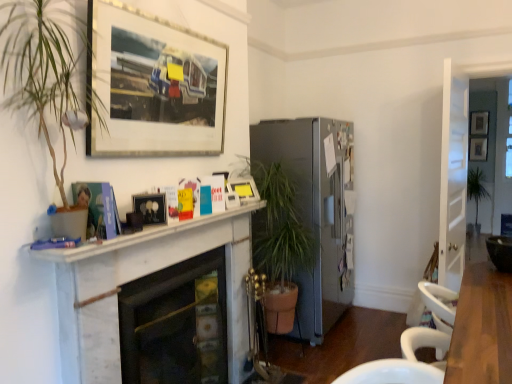
Question: Considering the positions of silver metallic picture frame at upper center, the 2th picture frame viewed from the left, and green leafy plant at right in the image, is silver metallic picture frame at upper center, the 2th picture frame viewed from the left, wider or thinner than green leafy plant at right?

Choices:
 (A) thin
 (B) wide

Answer: (A)

Question: Considering the positions of point (104, 11) and point (468, 188), is point (104, 11) closer or farther from the camera than point (468, 188)?

Choices:
 (A) closer
 (B) farther

Answer: (A)

Question: Which is farther from the green leafy plant at right?

Choices:
 (A) matte white fireplace at center, which appears as the first fireplace when viewed from the back
 (B) matte silver picture frame at upper right, which is counted as the 4th picture frame, starting from the front
 (C) wooden picture frame at upper right, arranged as the fifth picture frame when viewed from the front
 (D) white marble fireplace at upper center
 (E) white glossy door at right

Answer: (D)

Question: Based on their relative distances, which object is nearer to the white marble fireplace at upper center?

Choices:
 (A) green leafy plant at right
 (B) silver metallic picture frame at upper center, the 2th picture frame viewed from the left
 (C) matte black picture frame at center, the second picture frame viewed from the front
 (D) white marble fireplace at center, arranged as the 3th fireplace when viewed from the back
 (E) white glossy door at right

Answer: (D)